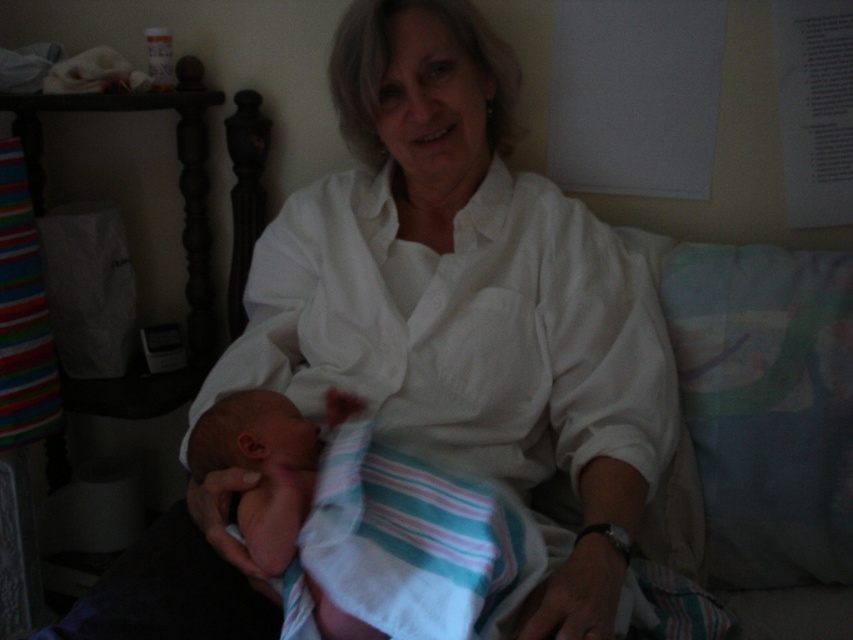
You are standing in the room and want to reach the point marked as point (538, 593). If you can move forward 30 inches, will you be able to reach it?

The distance between you and point (538, 593) is 33.82 inches. Since you can move forward 30 inches, you will not be able to reach it.

You are a photographer trying to capture a candid shot of the woman holding the baby without disturbing them. You notice a point at coordinates (465, 298) in the image. What object is located at that point?

The object at point (465, 298) is the white cotton shirt at center.